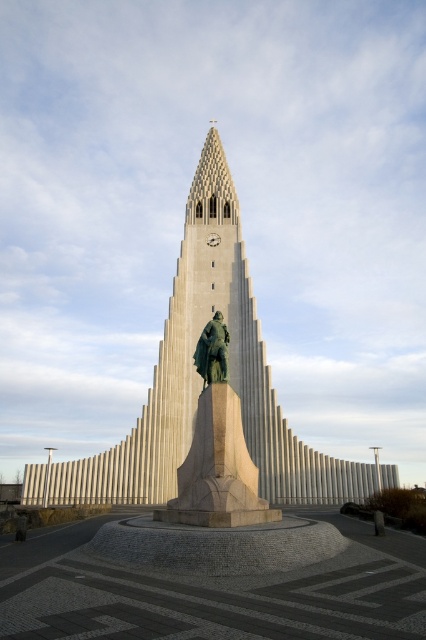
Question: Which object is closer to the camera taking this photo?

Choices:
 (A) light gray stone tower at center
 (B) bronze statue at center

Answer: (B)

Question: Considering the relative positions of green polished stone statue at center and bronze statue at center in the image provided, where is green polished stone statue at center located with respect to bronze statue at center?

Choices:
 (A) above
 (B) below

Answer: (B)

Question: Which of these objects is positioned farthest from the green polished stone statue at center?

Choices:
 (A) bronze statue at center
 (B) light gray stone tower at center

Answer: (B)

Question: Can you confirm if green polished stone statue at center is positioned above bronze statue at center?

Choices:
 (A) no
 (B) yes

Answer: (A)

Question: Does green polished stone statue at center have a smaller size compared to bronze statue at center?

Choices:
 (A) no
 (B) yes

Answer: (A)

Question: Which object appears farthest from the camera in this image?

Choices:
 (A) green polished stone statue at center
 (B) bronze statue at center
 (C) light gray stone tower at center

Answer: (C)